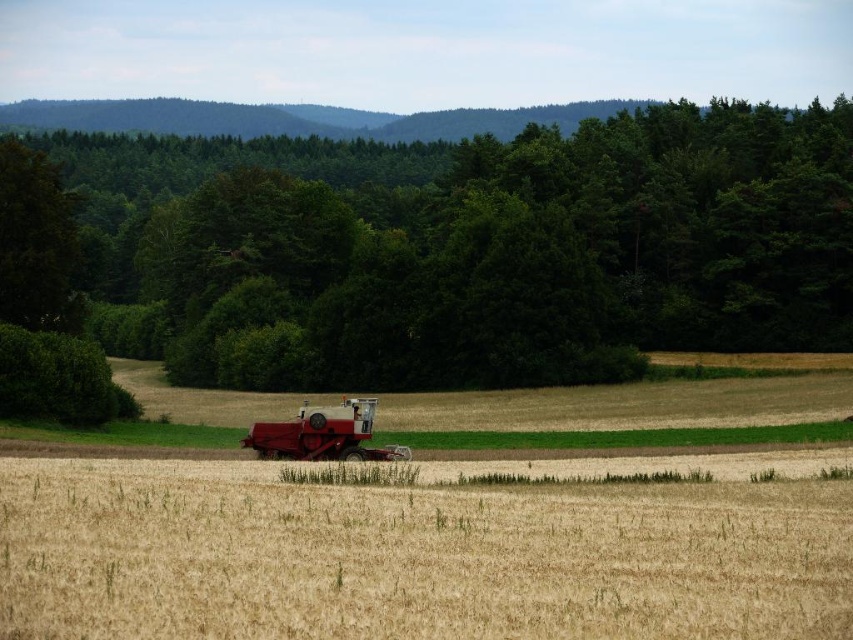
Between point (387, 221) and point (270, 436), which one is positioned in front?

Point (270, 436) is more forward.

Image resolution: width=853 pixels, height=640 pixels. In order to click on green leafy tree at center in this screenshot , I will do `click(463, 234)`.

Can you confirm if golden grain field at center is positioned to the left of metallic red combine at center?

No, golden grain field at center is not to the left of metallic red combine at center.

Who is higher up, golden grain field at center or metallic red combine at center?

metallic red combine at center

Does point (215, 520) lie behind point (262, 456)?

No, (215, 520) is closer to viewer.

The height and width of the screenshot is (640, 853). I want to click on golden grain field at center, so click(412, 557).

Is green leafy tree at center thinner than golden grain field at center?

No, green leafy tree at center is not thinner than golden grain field at center.

Which is behind, point (656, 300) or point (47, 500)?

The point (656, 300) is behind.

Image resolution: width=853 pixels, height=640 pixels. What do you see at coordinates (463, 234) in the screenshot?
I see `green leafy tree at center` at bounding box center [463, 234].

What are the coordinates of `green leafy tree at center` in the screenshot? It's located at (463, 234).